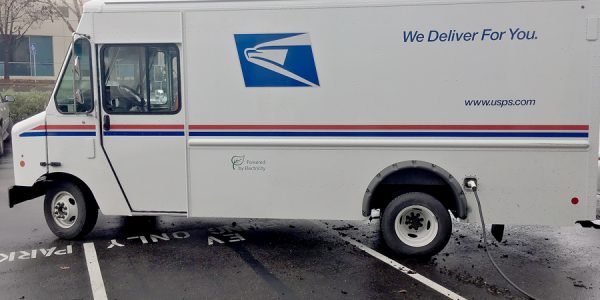
The image size is (600, 300). I want to click on left door, so click(x=146, y=133).